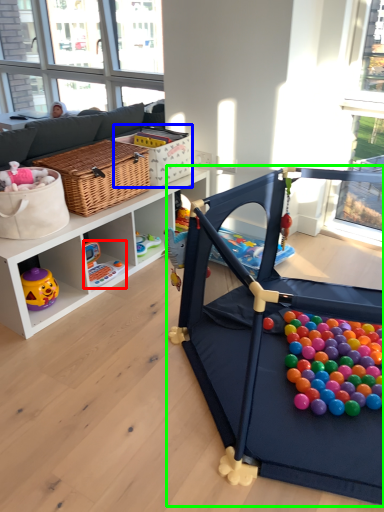
Question: Estimate the real-world distances between objects in this image. Which object is farther from toy (highlighted by a red box), basket (highlighted by a blue box) or toy (highlighted by a green box)?

Choices:
 (A) basket
 (B) toy

Answer: (B)